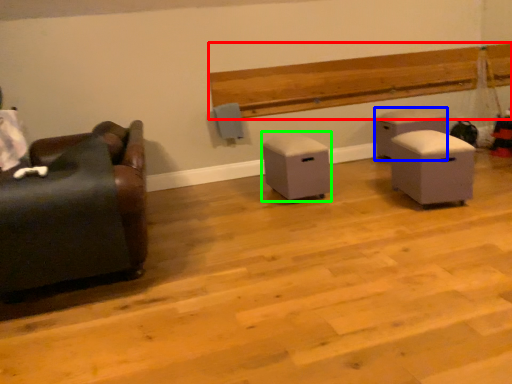
Question: Which is nearer to the hardwood (highlighted by a red box)? furniture (highlighted by a blue box) or furniture (highlighted by a green box).

Choices:
 (A) furniture
 (B) furniture

Answer: (A)